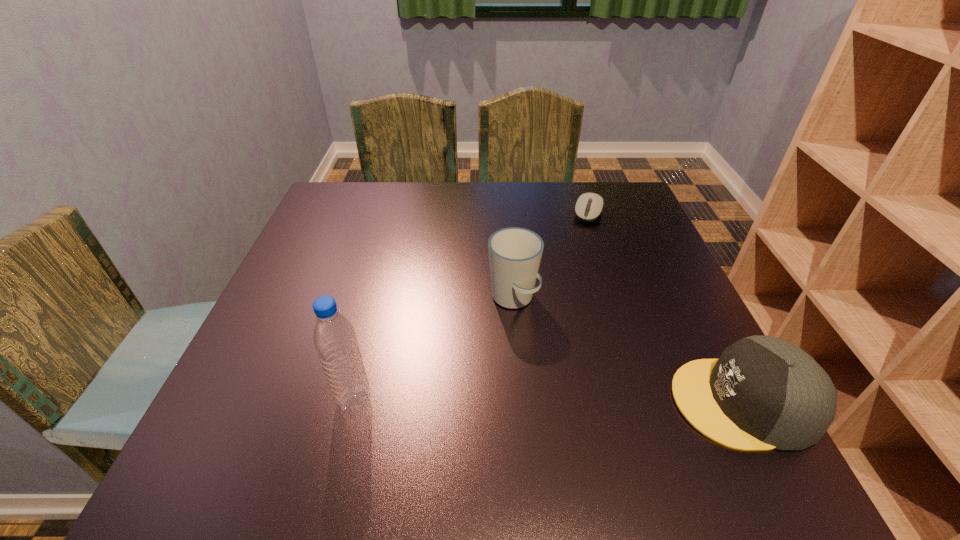
At what (x,y) coordinates should I click in order to perform the action: click on vacant space located 0.080m on the front-facing side of the cap. Please return your answer as a coordinate pair (x, y). The height and width of the screenshot is (540, 960). Looking at the image, I should click on (628, 402).

Where is `blank space located with a handle on the side of the second farthest object`? The height and width of the screenshot is (540, 960). blank space located with a handle on the side of the second farthest object is located at coordinates (603, 417).

Identify the location of vacant space located with a handle on the side of the second farthest object. (592, 403).

Where is `free point located with a handle on the side of the second farthest object`? The width and height of the screenshot is (960, 540). free point located with a handle on the side of the second farthest object is located at coordinates (x=569, y=373).

Image resolution: width=960 pixels, height=540 pixels. In order to click on free space located on the wheel side of the computer equipment in this screenshot , I will do `click(577, 249)`.

You are a GUI agent. You are given a task and a screenshot of the screen. Output one action in this format:
    pyautogui.click(x=<x>, y=<y>)
    Task: Click on the vacant space located 0.100m on the wheel side of the computer equipment
    The width and height of the screenshot is (960, 540).
    Given the screenshot: What is the action you would take?
    pyautogui.click(x=578, y=245)

Image resolution: width=960 pixels, height=540 pixels. Identify the location of free space located 0.090m on the wheel side of the computer equipment. (579, 242).

Find the location of a particular element. object that is at the far edge is located at coordinates (589, 206).

Where is `water bottle present at the near edge`? The image size is (960, 540). water bottle present at the near edge is located at coordinates click(x=334, y=338).

Find the location of a particular element. The height and width of the screenshot is (540, 960). cap at the near edge is located at coordinates pyautogui.click(x=763, y=392).